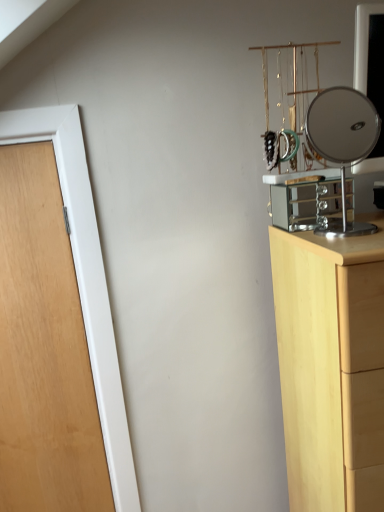
Where is `vacant space situated above wooden door at left (from a real-world perspective)`? This screenshot has height=512, width=384. vacant space situated above wooden door at left (from a real-world perspective) is located at coordinates (27, 104).